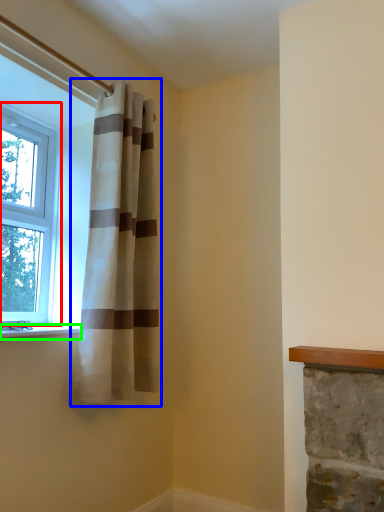
Question: Considering the real-world distances, which object is closest to window (highlighted by a red box)? curtain (highlighted by a blue box) or window sill (highlighted by a green box).

Choices:
 (A) curtain
 (B) window sill

Answer: (A)